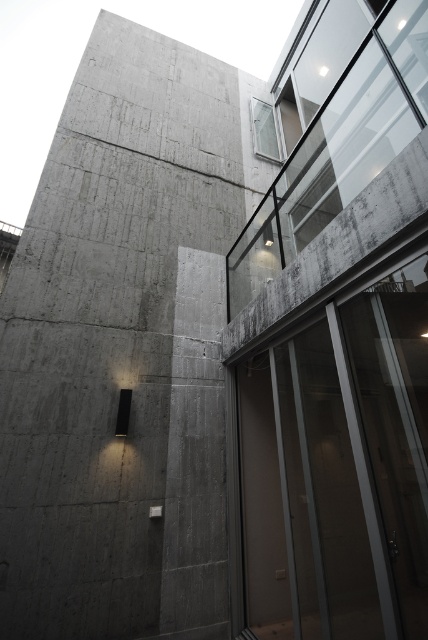
Question: Does gray concrete wall at left appear under transparent glass door at center?

Choices:
 (A) no
 (B) yes

Answer: (A)

Question: Which point is closer to the camera?

Choices:
 (A) (385, 332)
 (B) (247, 196)

Answer: (A)

Question: Which object appears farthest from the camera in this image?

Choices:
 (A) gray concrete wall at left
 (B) transparent glass door at center

Answer: (A)

Question: Can you confirm if gray concrete wall at left is positioned above transparent glass door at center?

Choices:
 (A) no
 (B) yes

Answer: (B)

Question: Is gray concrete wall at left to the left of transparent glass door at center from the viewer's perspective?

Choices:
 (A) no
 (B) yes

Answer: (B)